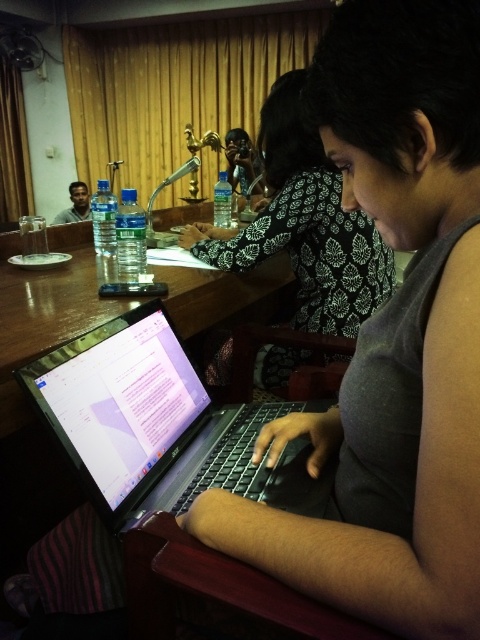
You are organizing a presentation and need to place both the black printed blouse at center and the matte black laptop at left on a small table. Which item should you place first to ensure they both fit?

The matte black laptop at left should be placed first because the black printed blouse at center is larger in size, so positioning the smaller item first allows more space for the larger one.

You are standing in the conference room and want to place a 70 cm wide laptop bag on the wooden table at center. Can you fit it on the table?

The wooden table at center is 75.12 centimeters away from viewer. This distance does not provide information about the table width. Therefore, it is impossible to determine if the 70 cm wide laptop bag will fit on the table.